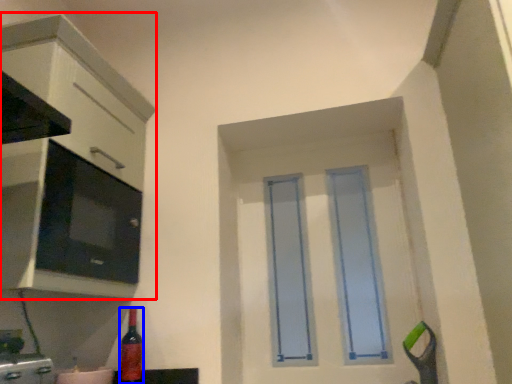
Question: Which of the following is the closest to the observer, cabinetry (highlighted by a red box) or bottle (highlighted by a blue box)?

Choices:
 (A) cabinetry
 (B) bottle

Answer: (A)